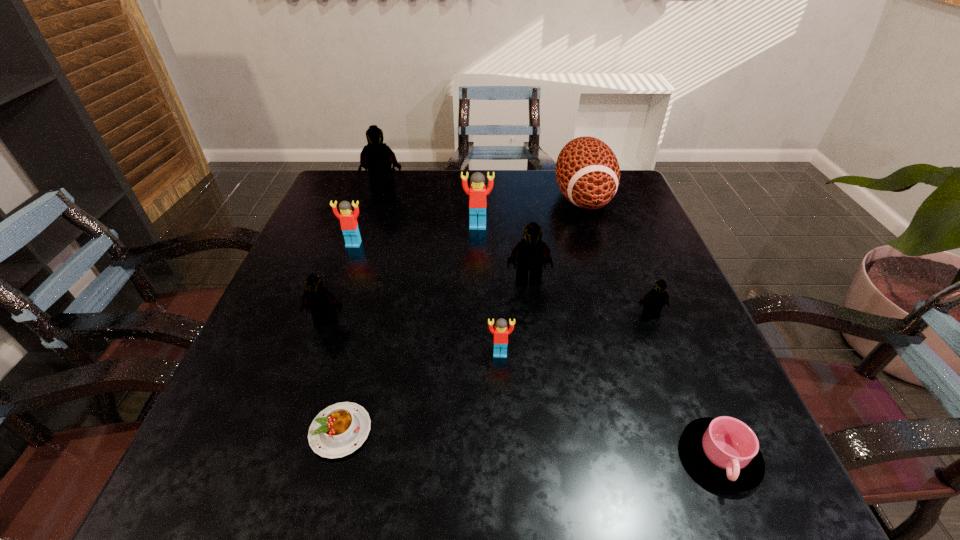
Locate an element on the screen. This screenshot has width=960, height=540. football located at the right edge is located at coordinates (587, 171).

In order to click on Lego at the right edge in this screenshot , I will do `click(654, 300)`.

Locate an element on the screen. Image resolution: width=960 pixels, height=540 pixels. cup that is at the right edge is located at coordinates (724, 451).

This screenshot has width=960, height=540. I want to click on object that is at the far left corner, so click(x=376, y=157).

The image size is (960, 540). Find the location of `object that is positioned at the far right corner`. object that is positioned at the far right corner is located at coordinates (587, 171).

Image resolution: width=960 pixels, height=540 pixels. Identify the location of object that is at the near right corner. (724, 451).

The image size is (960, 540). I want to click on blank space at the far edge of the desktop, so click(544, 198).

Find the location of a particular element. The width and height of the screenshot is (960, 540). free space at the left edge of the desktop is located at coordinates (301, 330).

You are a GUI agent. You are given a task and a screenshot of the screen. Output one action in this format:
    pyautogui.click(x=<x>, y=<y>)
    Task: Click on the vacant space at the right edge
    The image size is (960, 540).
    Given the screenshot: What is the action you would take?
    click(656, 329)

Locate an element on the screen. This screenshot has height=540, width=960. vacant area between the farthest red Lego and the leftmost red Lego is located at coordinates (416, 235).